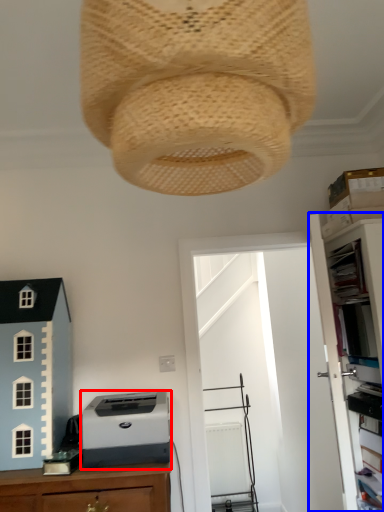
Question: Which object appears farthest to the camera in this image, printer (highlighted by a red box) or file cabinet (highlighted by a blue box)?

Choices:
 (A) printer
 (B) file cabinet

Answer: (A)